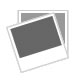
Find the location of `picture`. picture is located at coordinates (53, 21).